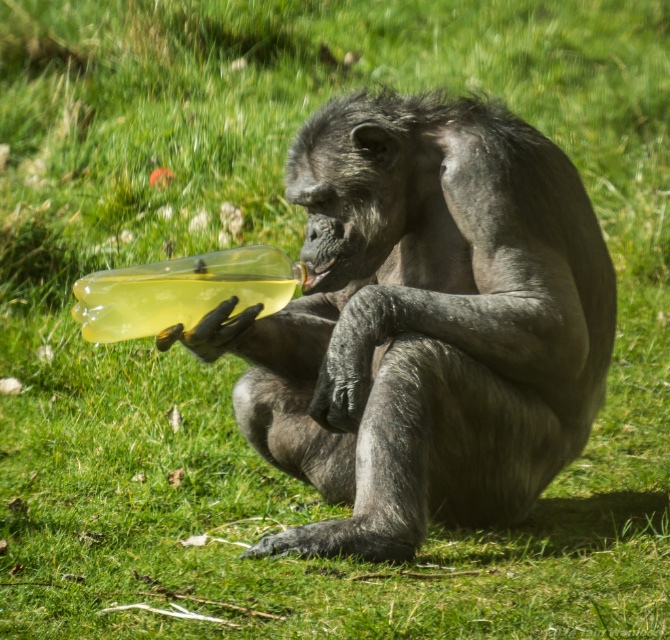
You are a photographer trying to capture a closeup of the shiny plastic bottle at center and the translucent yellow bottle at lower left. Which bottle should you focus on first to ensure both are in focus?

You should focus on the shiny plastic bottle at center first because it is closer to the viewer than the translucent yellow bottle at lower left, so adjusting focus from near to far will help both be in focus.